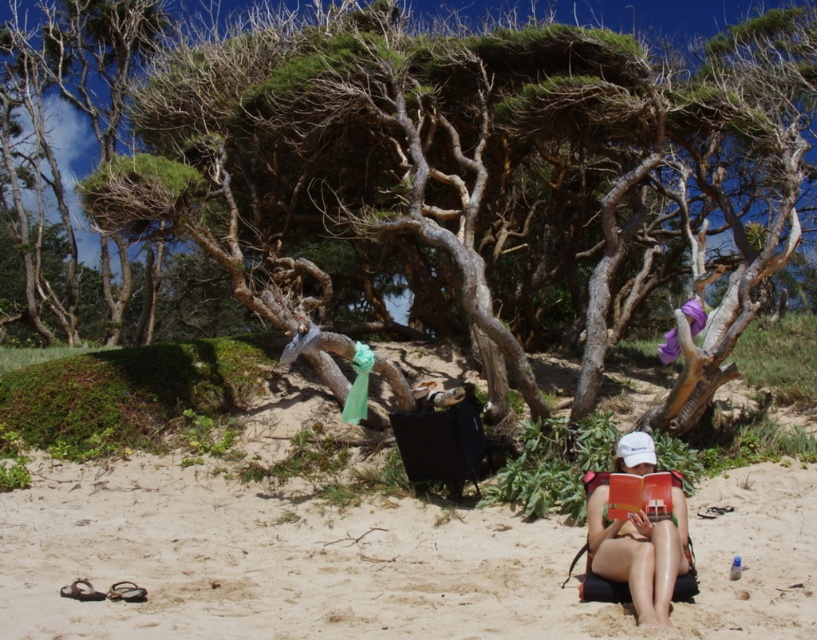
Question: Which object is positioned closest to the brown textured tree at center?

Choices:
 (A) beige sandy beach at lower center
 (B) tan skin bikini at lower right

Answer: (B)

Question: Which point is farther to the camera?

Choices:
 (A) (373, 621)
 (B) (252, 51)

Answer: (B)

Question: Which object is positioned closest to the brown textured tree at center?

Choices:
 (A) tan skin bikini at lower right
 (B) beige sandy beach at lower center

Answer: (A)

Question: Observing the image, what is the correct spatial positioning of brown textured tree at center in reference to tan skin bikini at lower right?

Choices:
 (A) below
 (B) above

Answer: (B)

Question: Can you confirm if brown textured tree at center is bigger than tan skin bikini at lower right?

Choices:
 (A) yes
 (B) no

Answer: (A)

Question: Does brown textured tree at center appear under beige sandy beach at lower center?

Choices:
 (A) yes
 (B) no

Answer: (B)